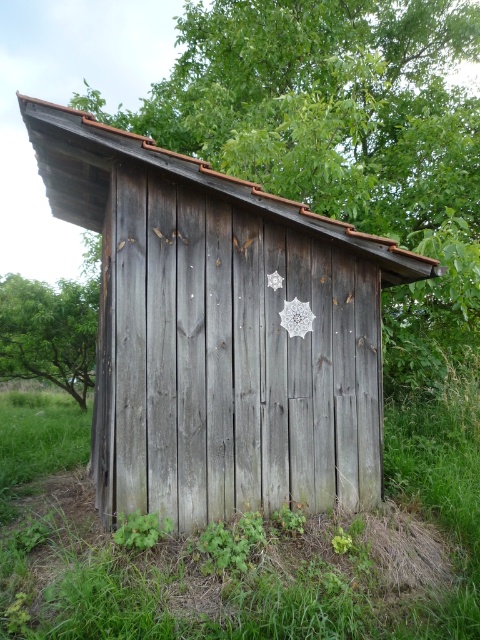
Question: Is weathered wood barn at center positioned before green wood at center?

Choices:
 (A) yes
 (B) no

Answer: (A)

Question: Which point is closer to the camera?

Choices:
 (A) green wood at center
 (B) green grass at lower center
 (C) green matte leaf at lower left
 (D) weathered wood barn at center

Answer: (D)

Question: Can you confirm if green wood at center is thinner than green grass at lower center?

Choices:
 (A) no
 (B) yes

Answer: (A)

Question: Which point appears closest to the camera in this image?

Choices:
 (A) (153, 520)
 (B) (255, 124)
 (C) (242, 285)
 (D) (29, 477)

Answer: (A)

Question: Does green grass at lower center come behind green matte leaf at lower left?

Choices:
 (A) no
 (B) yes

Answer: (B)

Question: Which object appears farthest from the camera in this image?

Choices:
 (A) green grass at lower center
 (B) green wood at center

Answer: (B)